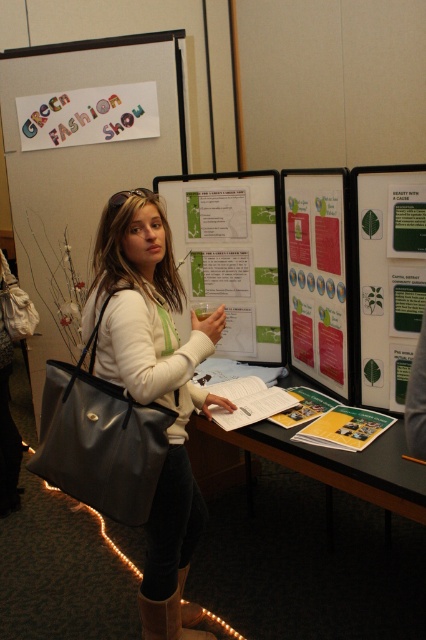
Question: Is green paper leaflet at center above matte paper table at center?

Choices:
 (A) yes
 (B) no

Answer: (A)

Question: Estimate the real-world distances between objects in this image. Which object is farther from the matte white poster at upper left?

Choices:
 (A) matte paper table at center
 (B) green paper leaflet at center
 (C) matte black bag at center

Answer: (B)

Question: Which point appears closest to the camera in this image?

Choices:
 (A) (108, 97)
 (B) (86, 332)

Answer: (B)

Question: Is the position of matte black bag at center more distant than that of green paper leaflet at center?

Choices:
 (A) yes
 (B) no

Answer: (B)

Question: From the image, what is the correct spatial relationship of matte black bag at center in relation to matte paper table at center?

Choices:
 (A) below
 (B) above

Answer: (B)

Question: Which point is closer to the camera?

Choices:
 (A) (278, 186)
 (B) (376, 493)
 (C) (60, 326)
 (D) (383, 250)

Answer: (B)